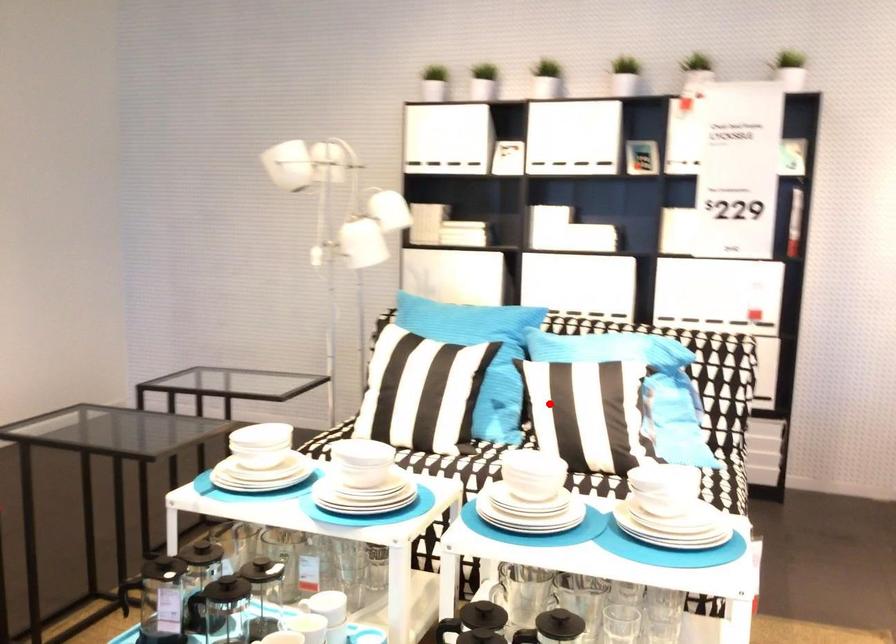
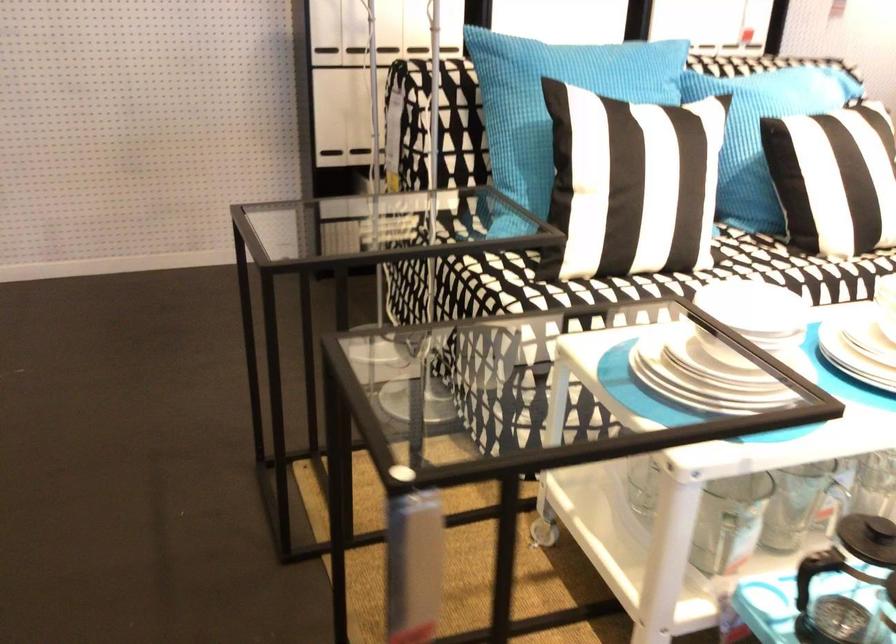
Where in the second image is the point corresponding to the highlighted location from the first image?

(833, 178)